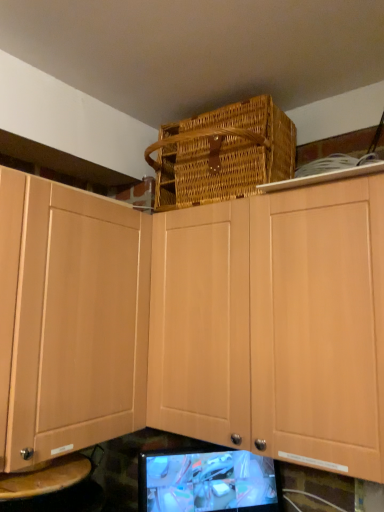
This screenshot has width=384, height=512. Describe the element at coordinates (207, 482) in the screenshot. I see `matte black monitor at lower center` at that location.

Identify the location of matte black monitor at lower center. The image size is (384, 512). (207, 482).

From a real-world perspective, is woven brown basket at upper center below matte black monitor at lower center?

Actually, woven brown basket at upper center is physically above matte black monitor at lower center in the real world.

Is woven brown basket at upper center behind matte black monitor at lower center?

No, the depth of woven brown basket at upper center is less than that of matte black monitor at lower center.

Considering the sizes of woven brown basket at upper center and matte black monitor at lower center in the image, is woven brown basket at upper center taller or shorter than matte black monitor at lower center?

woven brown basket at upper center is taller than matte black monitor at lower center.

Is matte black monitor at lower center located within woven brown basket at upper center?

No, woven brown basket at upper center does not contain matte black monitor at lower center.

Considering their positions, is matte black monitor at lower center located in front of or behind woven brown basket at upper center?

matte black monitor at lower center is behind woven brown basket at upper center.

From the image's perspective, is matte black monitor at lower center beneath woven brown basket at upper center?

Yes.

Between matte black monitor at lower center and woven brown basket at upper center, which one has less height?

Standing shorter between the two is matte black monitor at lower center.

Is woven brown basket at upper center with light wood cabinet at upper center?

They are not placed beside each other.

From a real-world perspective, which is physically below, woven brown basket at upper center or light wood cabinet at upper center?

In real-world perspective, light wood cabinet at upper center is lower.

Find the location of a particular element. basket above the light wood cabinet at upper center (from a real-world perspective) is located at coordinates (223, 154).

Is woven brown basket at upper center positioned in front of light wood cabinet at upper center?

No.

From a real-world perspective, between light wood cabinet at upper center and matte black monitor at lower center, who is vertically higher?

light wood cabinet at upper center, from a real-world perspective.

Between light wood cabinet at upper center and matte black monitor at lower center, which one appears on the left side from the viewer's perspective?

Positioned to the left is matte black monitor at lower center.

Which of these two, light wood cabinet at upper center or matte black monitor at lower center, stands taller?

light wood cabinet at upper center.

How many degrees apart are the facing directions of light wood cabinet at upper center and matte black monitor at lower center?

The facing directions of light wood cabinet at upper center and matte black monitor at lower center are 52.5 degrees apart.

Between point (255, 475) and point (258, 311), which one is positioned behind?

The point (255, 475) is more distant.

Is matte black monitor at lower center oriented away from light wood cabinet at upper center?

matte black monitor at lower center does not have its back to light wood cabinet at upper center.

Which is more to the right, matte black monitor at lower center or light wood cabinet at upper center?

Positioned to the right is light wood cabinet at upper center.

Is light wood cabinet at upper center far away from woven brown basket at upper center?

No, light wood cabinet at upper center is in close proximity to woven brown basket at upper center.

Considering the relative sizes of light wood cabinet at upper center and woven brown basket at upper center in the image provided, is light wood cabinet at upper center shorter than woven brown basket at upper center?

Incorrect, the height of light wood cabinet at upper center does not fall short of that of woven brown basket at upper center.

Based on the photo, which point is more distant from viewer, (373, 227) or (282, 166)?

The point (282, 166) is farther from the camera.

This screenshot has width=384, height=512. Identify the location of basket to the right of matte black monitor at lower center. (223, 154).

Where is `computer monitor behind the woven brown basket at upper center`? computer monitor behind the woven brown basket at upper center is located at coordinates (207, 482).

From the image, which object appears to be nearer to matte black monitor at lower center, light wood cabinet at upper center or woven brown basket at upper center?

light wood cabinet at upper center is positioned closer to the anchor matte black monitor at lower center.

Looking at the image, which one is located closer to matte black monitor at lower center, woven brown basket at upper center or light wood cabinet at upper center?

light wood cabinet at upper center lies closer to matte black monitor at lower center than the other object.

Considering their positions, is matte black monitor at lower center positioned further to light wood cabinet at upper center than woven brown basket at upper center?

matte black monitor at lower center is further to light wood cabinet at upper center.

Estimate the real-world distances between objects in this image. Which object is further from light wood cabinet at upper center, woven brown basket at upper center or matte black monitor at lower center?

matte black monitor at lower center lies further to light wood cabinet at upper center than the other object.

Based on their spatial positions, is light wood cabinet at upper center or matte black monitor at lower center further from woven brown basket at upper center?

matte black monitor at lower center lies further to woven brown basket at upper center than the other object.

Which object lies further to the anchor point woven brown basket at upper center, matte black monitor at lower center or light wood cabinet at upper center?

Based on the image, matte black monitor at lower center appears to be further to woven brown basket at upper center.

At what (x,y) coordinates should I click in order to perform the action: click on cabinetry between woven brown basket at upper center and matte black monitor at lower center in the up-down direction. Please return your answer as a coordinate pair (x, y). The height and width of the screenshot is (512, 384). Looking at the image, I should click on (198, 322).